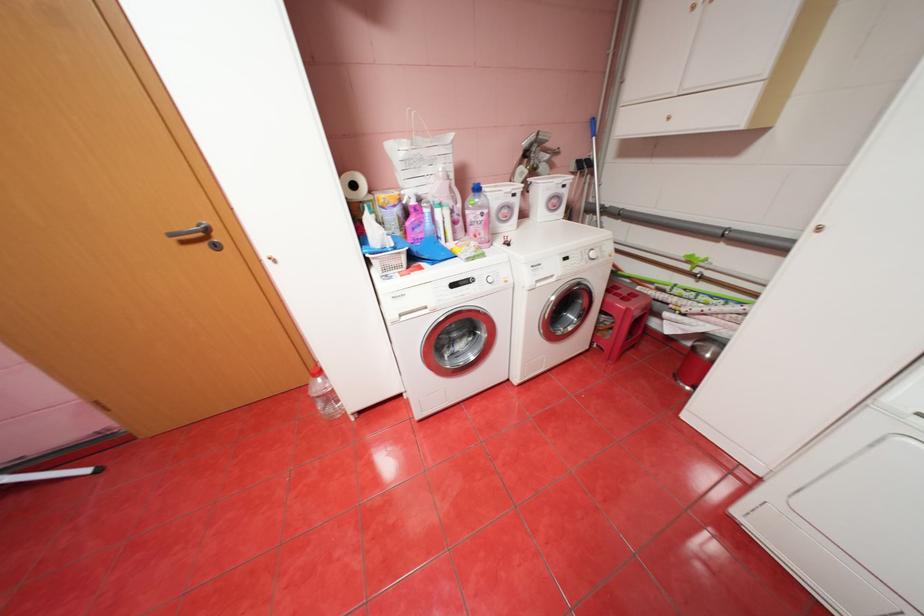
Find where to pull the silver door handle. Please return your answer as a coordinate pair (x, y).

(181, 232)